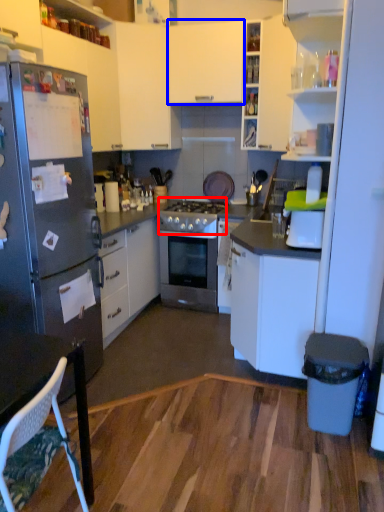
Question: Which point is closer to the camera, gas stove (highlighted by a red box) or cabinetry (highlighted by a blue box)?

Choices:
 (A) gas stove
 (B) cabinetry

Answer: (B)